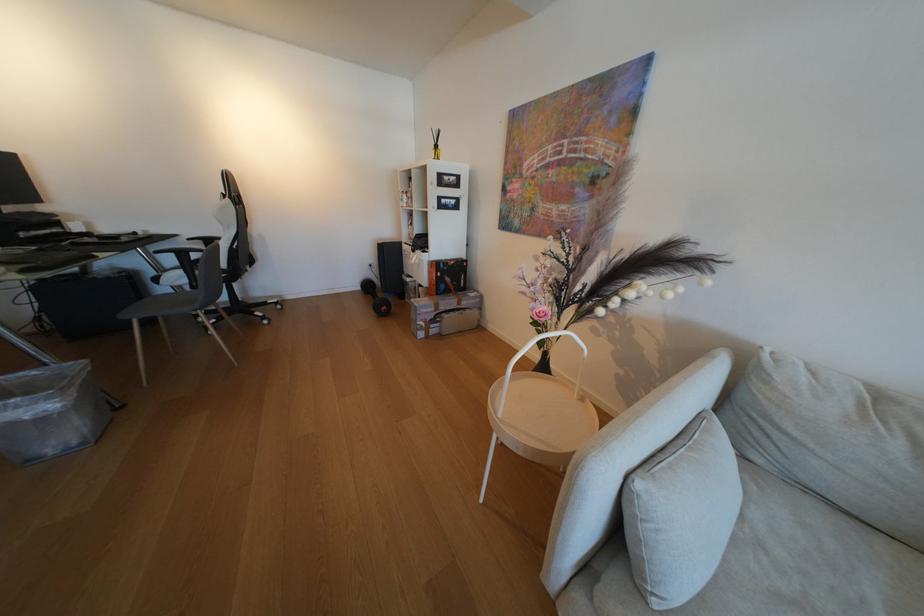
This screenshot has width=924, height=616. What do you see at coordinates (232, 300) in the screenshot? I see `the black chair armrest` at bounding box center [232, 300].